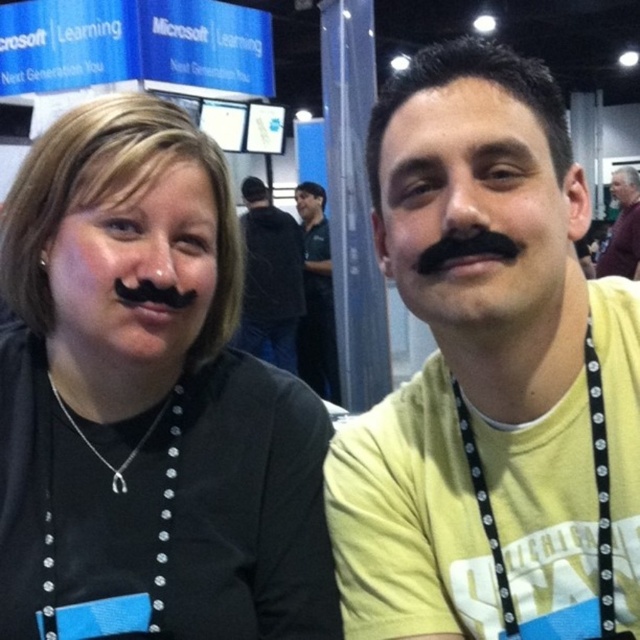
Question: Which of the following is the farthest from the observer?

Choices:
 (A) (61, 131)
 (B) (486, 156)
 (C) (252, 221)

Answer: (C)

Question: Is yellow cotton shirt at center below dark green shirt at center?

Choices:
 (A) no
 (B) yes

Answer: (B)

Question: Considering the real-world distances, which object is closest to the dark green shirt at center?

Choices:
 (A) purple shirt at upper right
 (B) black fabric at left
 (C) black fabric shirt at center

Answer: (C)

Question: Which object is positioned farthest from the purple shirt at upper right?

Choices:
 (A) black fabric at left
 (B) black fabric shirt at center

Answer: (A)

Question: Is black fabric at left closer to the viewer compared to black fabric shirt at center?

Choices:
 (A) yes
 (B) no

Answer: (A)

Question: Does yellow cotton shirt at center appear on the left side of purple shirt at upper right?

Choices:
 (A) yes
 (B) no

Answer: (A)